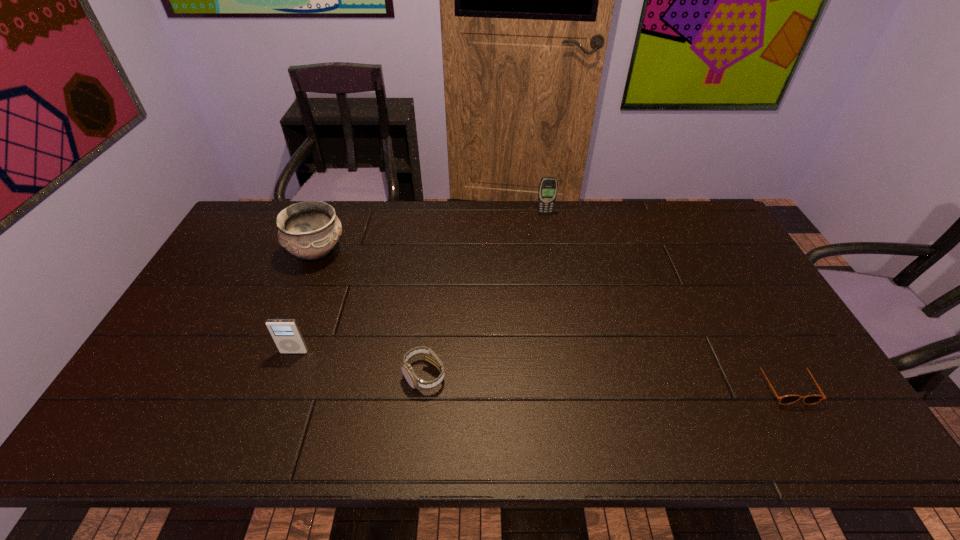
At what (x,y) coordinates should I click in order to perform the action: click on free location at the far left corner. Please return your answer as a coordinate pair (x, y). The width and height of the screenshot is (960, 540). Looking at the image, I should click on (288, 205).

Where is `vacant space at the far right corner`? This screenshot has width=960, height=540. vacant space at the far right corner is located at coordinates (665, 205).

Where is `free space between the third object from left to right and the iPod`? The width and height of the screenshot is (960, 540). free space between the third object from left to right and the iPod is located at coordinates (359, 363).

Find the location of `free space between the farthest object and the third tallest object`. free space between the farthest object and the third tallest object is located at coordinates tap(420, 282).

Identify the location of empty space between the shortest object and the farthest object. The height and width of the screenshot is (540, 960). (x=665, y=299).

Where is `empty space that is in between the third tallest object and the shortest object`? The height and width of the screenshot is (540, 960). empty space that is in between the third tallest object and the shortest object is located at coordinates (540, 368).

Where is `blank region between the iPod and the rightmost object`? This screenshot has width=960, height=540. blank region between the iPod and the rightmost object is located at coordinates (540, 368).

Identify the location of vacant point located between the third object from right to left and the fourth nearest object. (371, 314).

The image size is (960, 540). Identify the location of vacant area that lies between the fourth nearest object and the shortest object. (551, 318).

Locate an element on the screen. This screenshot has width=960, height=540. empty space that is in between the pottery and the shortest object is located at coordinates point(551,318).